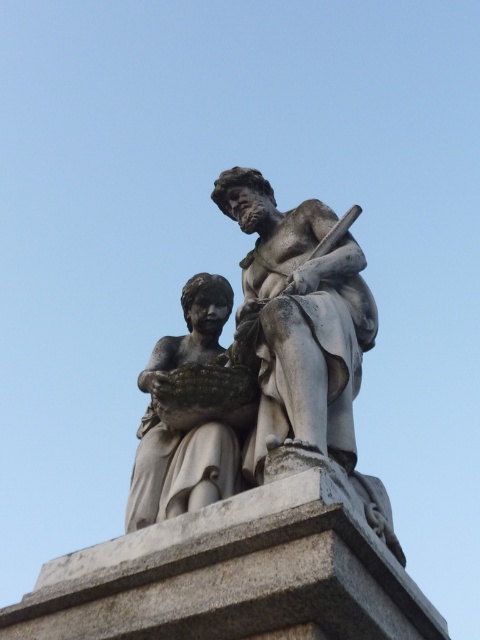
You are an art conservator examining the classical sculpture. You need to place a protective cover over the gray stone statue at center and the gray stone pedestal at center. Since the cover can only be placed on one object at a time, which object should you cover first if you want to protect the one that is more exposed to rain?

The gray stone statue at center is to the right of the gray stone pedestal at center, so it is more exposed to rain and should be covered first.

You are an art conservator assessing the placement of the gray stone statue at center and the matte stone child at center. Given their sizes, which one would require a more stable base to prevent tipping over?

The gray stone statue at center is larger in size than the matte stone child at center, so it would require a more stable base to prevent tipping over due to its greater weight and size.

You are standing in front of a classical sculpture garden. You see the gray stone statue at center. If you want to take a photo of it, where should you position yourself relative to the statue to ensure it is centered in your camera frame?

To center the gray stone statue at center in your camera frame, position yourself directly in front of it at point (261, 365).